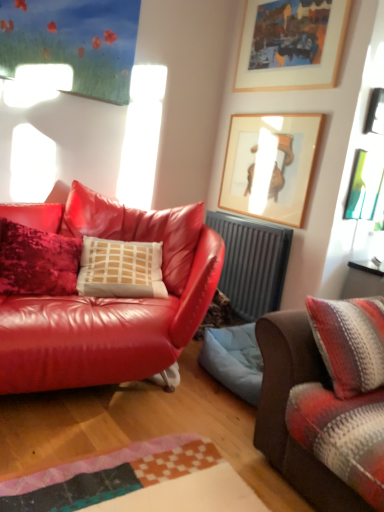
Question: Considering the relative positions of gray metallic radiator at center and shiny leather couch at left, the 1th studio couch from the left, in the image provided, is gray metallic radiator at center to the left or to the right of shiny leather couch at left, the 1th studio couch from the left,?

Choices:
 (A) right
 (B) left

Answer: (A)

Question: Is point (244, 314) positioned closer to the camera than point (114, 376)?

Choices:
 (A) closer
 (B) farther

Answer: (B)

Question: Estimate the real-world distances between objects in this image. Which object is closer to the gray metallic radiator at center?

Choices:
 (A) wooden framed artwork at upper center, the second picture frame when ordered from bottom to top
 (B) wooden picture frame at upper center, arranged as the 4th picture frame when ordered from the bottom
 (C) striped woolen blanket at right, the first studio couch positioned from the right
 (D) shiny leather couch at left, the 1th studio couch from the left
 (E) metallic silver frame at upper right, which is counted as the fourth picture frame, starting from the top

Answer: (A)

Question: Which object is positioned closest to the wooden framed artwork at upper center, the second picture frame when ordered from bottom to top?

Choices:
 (A) gray metallic radiator at center
 (B) metallic silver picture frame at upper right, acting as the second picture frame starting from the top
 (C) wooden picture frame at upper center, the first picture frame from the top
 (D) striped woolen blanket at right, the first studio couch positioned from the right
 (E) metallic silver frame at upper right, which is counted as the fourth picture frame, starting from the top

Answer: (A)